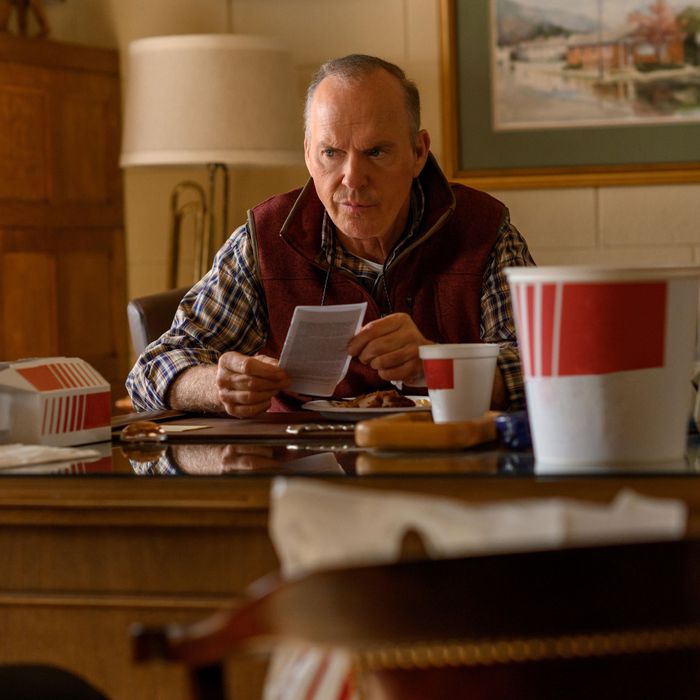
You are a GUI agent. You are given a task and a screenshot of the screen. Output one action in this format:
    pyautogui.click(x=<x>, y=<y>)
    Task: Click on the glass paper weight, to right of chicken box
    The image size is (700, 700).
    Given the screenshot: What is the action you would take?
    pyautogui.click(x=145, y=435)